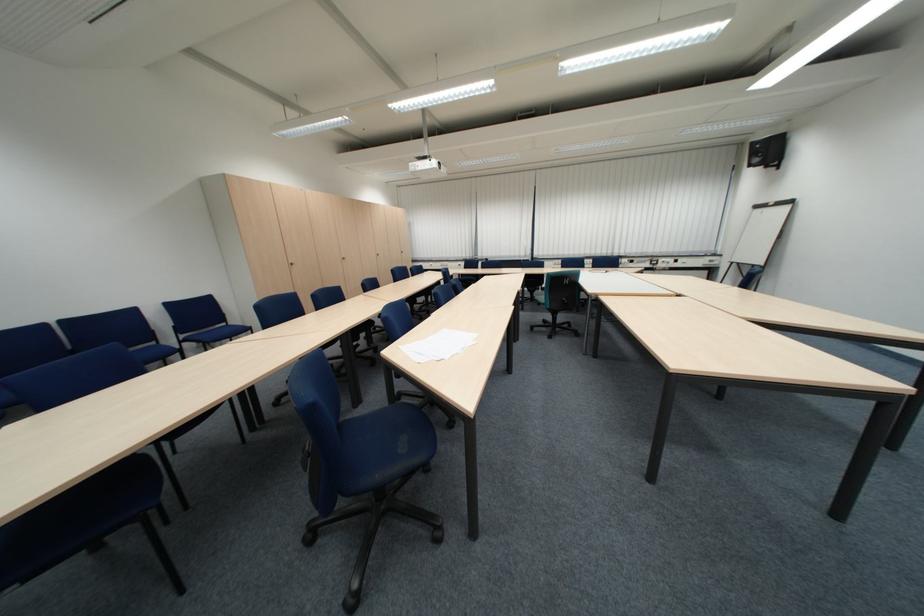
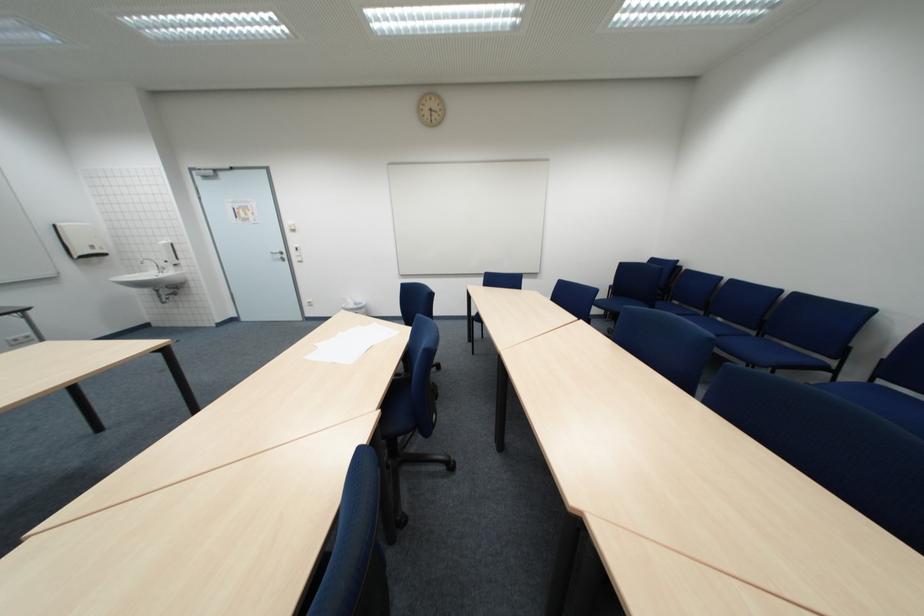
Question: I am providing you with two images of the same scene from different viewpoints. After the viewpoint changes to image2, which objects are now occluded?

Choices:
 (A) blue chair sitting surface
 (B) silver door handle
 (C) stack of papers
 (D) silver container

Answer: (C)